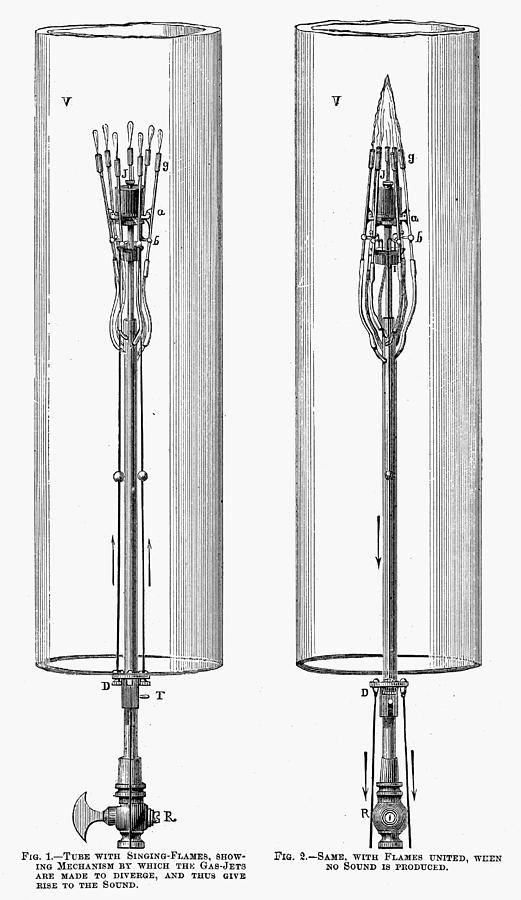
Locate an element on the screen. glass is located at coordinates (56, 484).